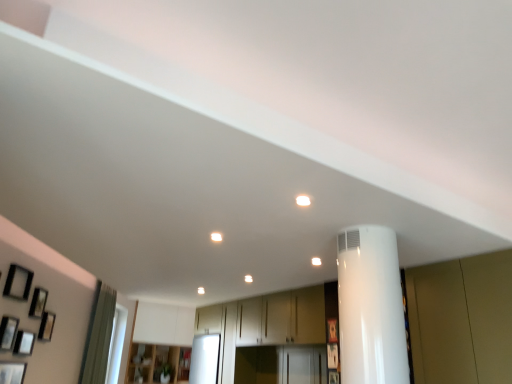
Question: Is matte black picture frame at lower left, arranged as the 8th picture frame when viewed from the right, completely or partially inside matte black picture frame at left, the 6th picture frame viewed from the left?

Choices:
 (A) yes
 (B) no

Answer: (B)

Question: Does matte black picture frame at left, the 6th picture frame viewed from the left, have a smaller size compared to matte black picture frame at lower left, arranged as the 8th picture frame when viewed from the right?

Choices:
 (A) yes
 (B) no

Answer: (A)

Question: Can you confirm if matte black picture frame at left, the 3th picture frame in the right-to-left sequence, is wider than matte black picture frame at lower left, arranged as the 8th picture frame when viewed from the right?

Choices:
 (A) no
 (B) yes

Answer: (A)

Question: Is matte black picture frame at left, the 3th picture frame in the right-to-left sequence, turned away from matte black picture frame at lower left, arranged as the 8th picture frame when viewed from the right?

Choices:
 (A) yes
 (B) no

Answer: (B)

Question: From a real-world perspective, is matte black picture frame at left, the 3th picture frame in the right-to-left sequence, located higher than matte black picture frame at lower left, arranged as the 8th picture frame when viewed from the right?

Choices:
 (A) yes
 (B) no

Answer: (A)

Question: Looking at their shapes, would you say matte black picture frame at left, which is the fourth picture frame in left-to-right order, is wider or thinner than wooden cabinet at center?

Choices:
 (A) wide
 (B) thin

Answer: (B)

Question: From a real-world perspective, is matte black picture frame at left, acting as the fifth picture frame starting from the right, positioned above or below wooden cabinet at center?

Choices:
 (A) above
 (B) below

Answer: (A)

Question: Considering the positions of matte black picture frame at left, which is the fourth picture frame in left-to-right order, and wooden cabinet at center in the image, is matte black picture frame at left, which is the fourth picture frame in left-to-right order, taller or shorter than wooden cabinet at center?

Choices:
 (A) tall
 (B) short

Answer: (B)

Question: Considering their positions, is matte black picture frame at left, acting as the fifth picture frame starting from the right, located in front of or behind wooden cabinet at center?

Choices:
 (A) front
 (B) behind

Answer: (A)

Question: Looking at the image, does matte black picture frame at left, which is the fourth picture frame in left-to-right order, seem bigger or smaller compared to wooden picture frame at center, which is the eighth picture frame from left to right?

Choices:
 (A) small
 (B) big

Answer: (B)

Question: Is point (11, 340) positioned closer to the camera than point (326, 322)?

Choices:
 (A) farther
 (B) closer

Answer: (B)

Question: From a real-world perspective, relative to wooden picture frame at center, which is the first picture frame from right to left, is matte black picture frame at left, which is the fourth picture frame in left-to-right order, vertically above or below?

Choices:
 (A) above
 (B) below

Answer: (B)

Question: Visually, is matte black picture frame at left, which is the fourth picture frame in left-to-right order, positioned to the left or to the right of wooden picture frame at center, which is the eighth picture frame from left to right?

Choices:
 (A) right
 (B) left

Answer: (B)

Question: Looking at the image, does matte black picture frame at lower left, arranged as the 8th picture frame when viewed from the right, seem bigger or smaller compared to matte black picture frame at left, which is the fourth picture frame in left-to-right order?

Choices:
 (A) big
 (B) small

Answer: (A)

Question: From a real-world perspective, relative to matte black picture frame at left, acting as the fifth picture frame starting from the right, is matte black picture frame at lower left, placed as the 1th picture frame when sorted from left to right, vertically above or below?

Choices:
 (A) below
 (B) above

Answer: (A)